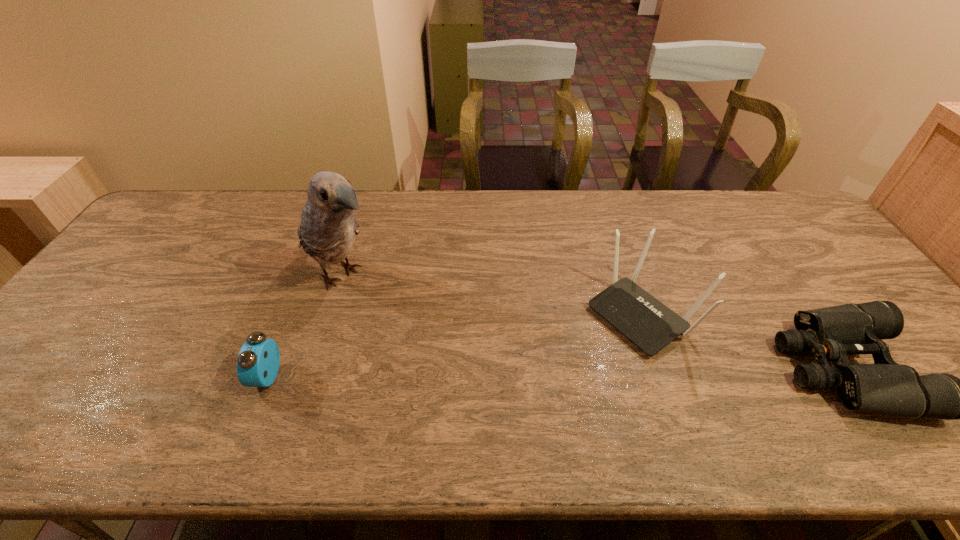
Where is `free space on the desktop that is between the alarm clock and the rightmost object and is positioned on the front-facing side of the parrot`? The image size is (960, 540). free space on the desktop that is between the alarm clock and the rightmost object and is positioned on the front-facing side of the parrot is located at coordinates (477, 373).

Locate an element on the screen. The image size is (960, 540). free spot on the desktop that is between the alarm clock and the binoculars and is positioned on the front-facing side of the second tallest object is located at coordinates (559, 372).